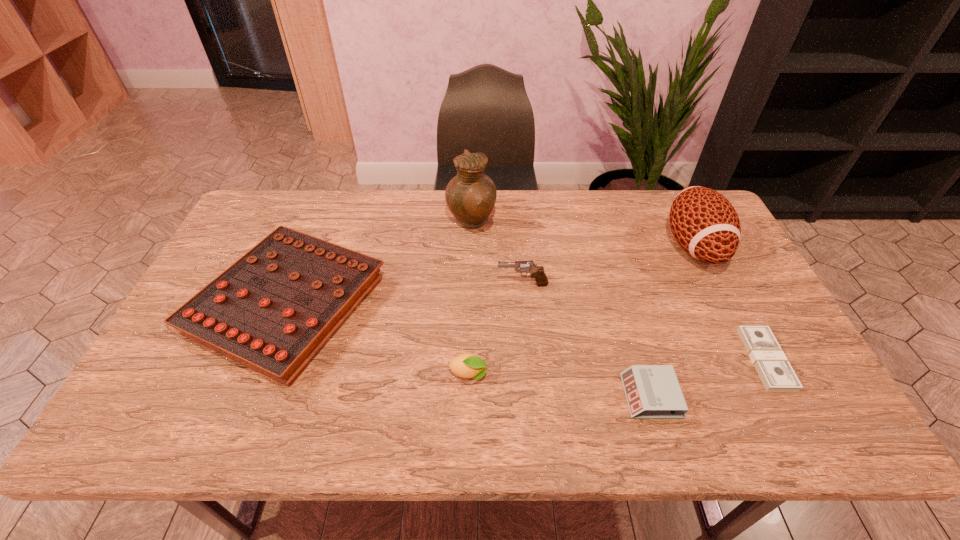
Locate an element on the screen. This screenshot has height=540, width=960. object that can be found as the third closest to the football is located at coordinates (537, 272).

Identify which object is the third nearest to the dollar. Please provide its 2D coordinates. Your answer should be formatted as a tuple, i.e. [(x, y)], where the tuple contains the x and y coordinates of a point satisfying the conditions above.

[(537, 272)]

In order to click on vacant space that satisfies the following two spatial constraints: 1. at the spout of the pitcher; 2. on the right side of the second shortest object in this screenshot , I will do `click(468, 396)`.

Identify the location of vacant space that satisfies the following two spatial constraints: 1. at the spout of the pitcher; 2. on the left side of the shortest object. (468, 359).

Where is `vacant space that satisfies the following two spatial constraints: 1. at the spout of the pitcher; 2. on the back side of the second tallest object`? The height and width of the screenshot is (540, 960). vacant space that satisfies the following two spatial constraints: 1. at the spout of the pitcher; 2. on the back side of the second tallest object is located at coordinates (470, 246).

Locate an element on the screen. free space that satisfies the following two spatial constraints: 1. at the barrel of the third object from right to left; 2. on the right side of the fifth shortest object is located at coordinates (533, 396).

Where is `free region that satisfies the following two spatial constraints: 1. with leaves positioned above the third object from right to left; 2. on the left side of the fifth tallest object`? free region that satisfies the following two spatial constraints: 1. with leaves positioned above the third object from right to left; 2. on the left side of the fifth tallest object is located at coordinates (468, 396).